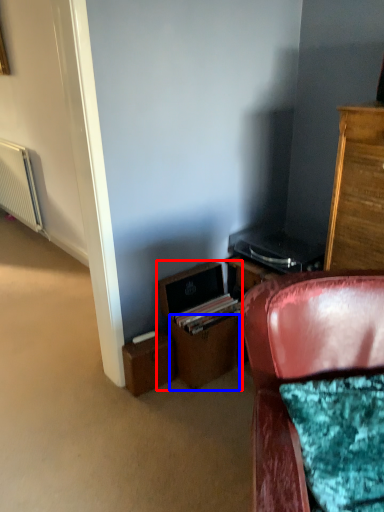
Question: Which point is closer to the camera, file cabinet (highlighted by a red box) or drawer (highlighted by a blue box)?

Choices:
 (A) file cabinet
 (B) drawer

Answer: (A)